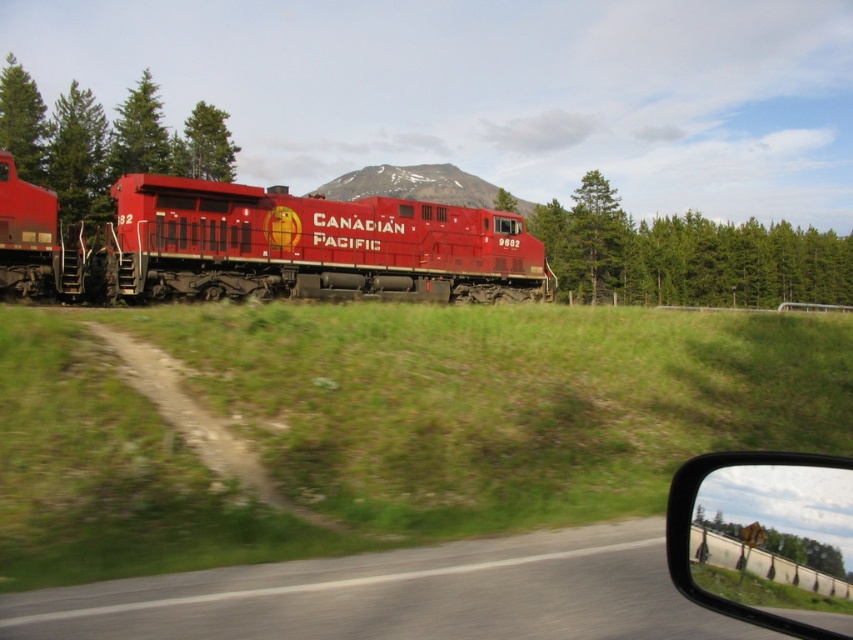
Which is above, green textured tree at center or green leafy tree at upper center?

Positioned higher is green leafy tree at upper center.

Between point (604, 186) and point (207, 161), which one is positioned behind?

Positioned behind is point (604, 186).

Is point (592, 253) in front of point (189, 145)?

That is False.

Image resolution: width=853 pixels, height=640 pixels. I want to click on green textured tree at center, so coord(592,240).

From the picture: Can you confirm if green leafy trees at center is positioned above green leafy tree at left?

Actually, green leafy trees at center is below green leafy tree at left.

Is green leafy trees at center to the right of green leafy tree at left from the viewer's perspective?

Indeed, green leafy trees at center is positioned on the right side of green leafy tree at left.

Between point (843, 285) and point (9, 68), which one is positioned behind?

Positioned behind is point (843, 285).

Locate an element on the screen. green leafy trees at center is located at coordinates (686, 256).

Is point (196, 108) farther from camera compared to point (503, 227)?

Yes, point (196, 108) is farther from viewer.

At what (x,y) coordinates should I click in order to perform the action: click on green leafy tree at upper center. Please return your answer as a coordinate pair (x, y). Looking at the image, I should click on (207, 145).